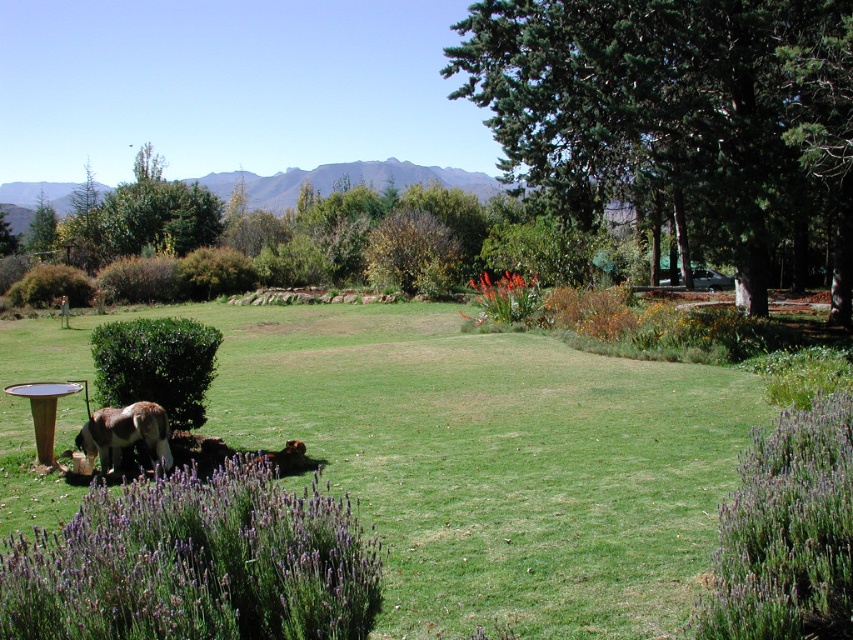
Does brown fuzzy elephant at lower left appear over brown furry dog at lower left?

Correct, brown fuzzy elephant at lower left is located above brown furry dog at lower left.

Is brown fuzzy elephant at lower left positioned before brown furry dog at lower left?

That is True.

Between point (96, 449) and point (305, 468), which one is positioned behind?

Point (305, 468)

You are a GUI agent. You are given a task and a screenshot of the screen. Output one action in this format:
    pyautogui.click(x=<x>, y=<y>)
    Task: Click on the brown fuzzy elephant at lower left
    The width and height of the screenshot is (853, 640).
    Given the screenshot: What is the action you would take?
    pyautogui.click(x=125, y=433)

Does green grass at center appear on the left side of brown fuzzy elephant at lower left?

Incorrect, green grass at center is not on the left side of brown fuzzy elephant at lower left.

Image resolution: width=853 pixels, height=640 pixels. What do you see at coordinates (456, 456) in the screenshot?
I see `green grass at center` at bounding box center [456, 456].

Where is `green grass at center`? This screenshot has height=640, width=853. green grass at center is located at coordinates [456, 456].

Is the position of purple soft lavender at lower left less distant than that of brown furry dog at lower left?

Yes, it is.

Who is more distant from viewer, (x=286, y=572) or (x=282, y=456)?

Point (x=282, y=456)

You are a GUI agent. You are given a task and a screenshot of the screen. Output one action in this format:
    pyautogui.click(x=<x>, y=<y>)
    Task: Click on the purple soft lavender at lower left
    The width and height of the screenshot is (853, 640).
    Given the screenshot: What is the action you would take?
    pyautogui.click(x=195, y=563)

You are a GUI agent. You are given a task and a screenshot of the screen. Output one action in this format:
    pyautogui.click(x=<x>, y=<y>)
    Task: Click on the purple soft lavender at lower left
    The width and height of the screenshot is (853, 640).
    Given the screenshot: What is the action you would take?
    pyautogui.click(x=195, y=563)